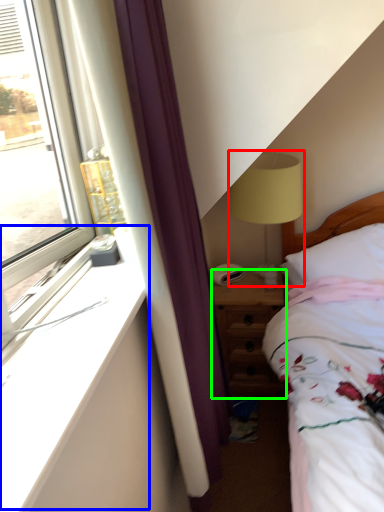
Question: Which object is the farthest from table lamp (highlighted by a red box)? Choose among these: window sill (highlighted by a blue box) or nightstand (highlighted by a green box).

Choices:
 (A) window sill
 (B) nightstand

Answer: (A)